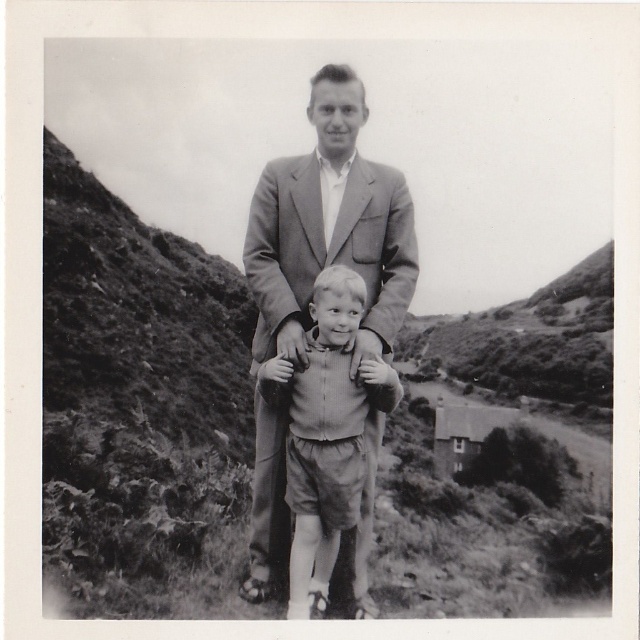
Question: Among these objects, which one is farthest from the camera?

Choices:
 (A) smooth gray suit at center
 (B) grassy hillside at center
 (C) smooth fabric sweater at center

Answer: (B)

Question: Estimate the real-world distances between objects in this image. Which object is closer to the smooth fabric sweater at center?

Choices:
 (A) grassy hillside at center
 (B) smooth gray suit at center

Answer: (B)

Question: Is grassy hillside at center positioned before smooth fabric sweater at center?

Choices:
 (A) no
 (B) yes

Answer: (A)

Question: Is smooth gray suit at center positioned behind smooth fabric sweater at center?

Choices:
 (A) yes
 (B) no

Answer: (A)

Question: Which object appears closest to the camera in this image?

Choices:
 (A) smooth gray suit at center
 (B) smooth fabric sweater at center
 (C) grassy hillside at center

Answer: (B)

Question: Can you confirm if grassy hillside at center is thinner than smooth fabric sweater at center?

Choices:
 (A) no
 (B) yes

Answer: (A)